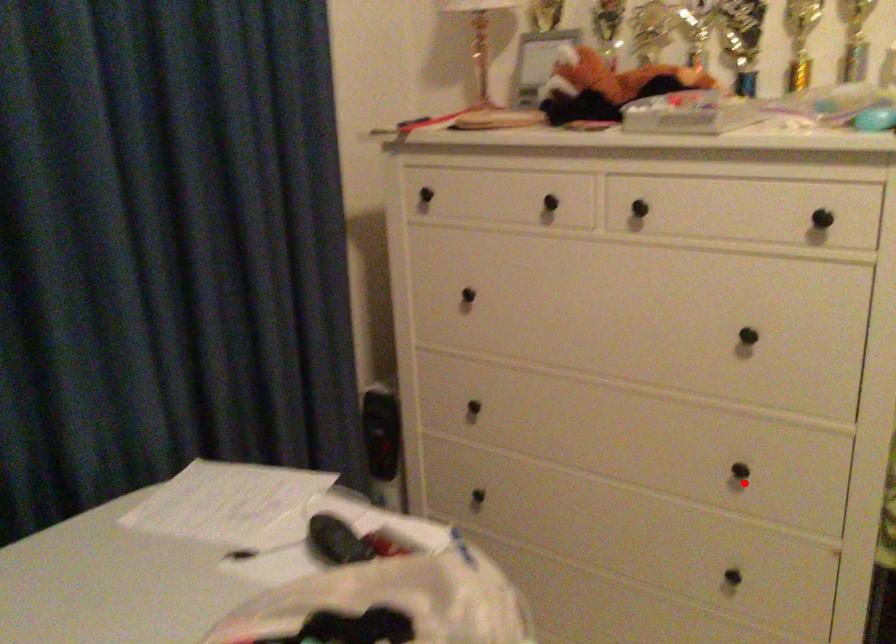
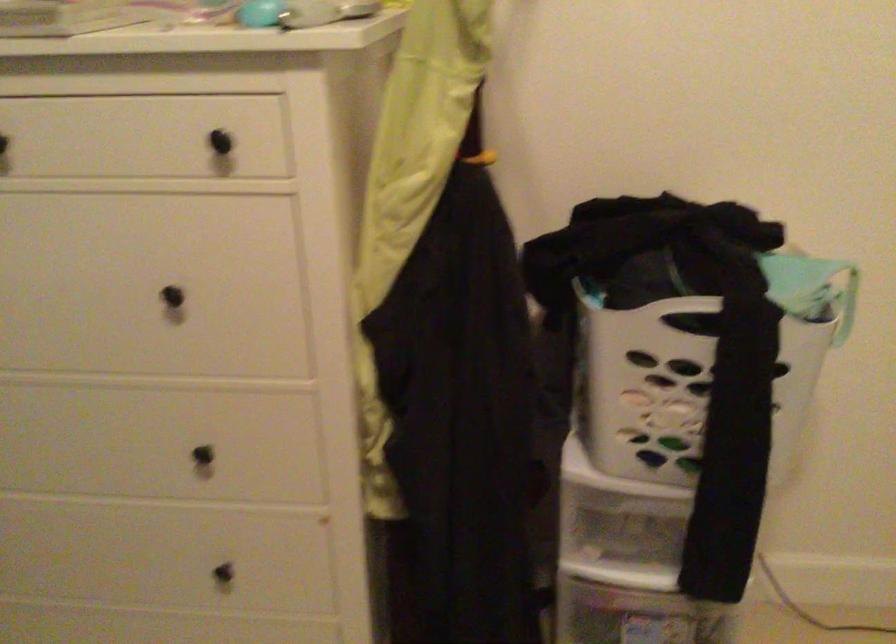
Question: I am providing you with two images of the same scene from different viewpoints. Given a red point in image1, look at the same physical point in image2. Is it:

Choices:
 (A) Closer to the viewpoint
 (B) Farther from the viewpoint

Answer: (A)